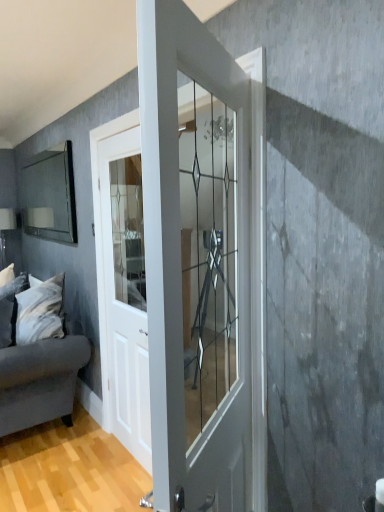
Question: Is the depth of white soft pillow at left greater than that of velvet gray couch at left?

Choices:
 (A) yes
 (B) no

Answer: (A)

Question: Does white soft pillow at left contain velvet gray couch at left?

Choices:
 (A) no
 (B) yes

Answer: (A)

Question: Considering the relative positions of white soft pillow at left and velvet gray couch at left in the image provided, is white soft pillow at left in front of velvet gray couch at left?

Choices:
 (A) yes
 (B) no

Answer: (B)

Question: Considering the relative sizes of white soft pillow at left and velvet gray couch at left in the image provided, is white soft pillow at left smaller than velvet gray couch at left?

Choices:
 (A) yes
 (B) no

Answer: (A)

Question: Could you tell me if white soft pillow at left is turned towards velvet gray couch at left?

Choices:
 (A) yes
 (B) no

Answer: (A)

Question: In the image, is white glossy door at center, which is the 2th door in front-to-back order, on the left side or the right side of white soft pillow at left?

Choices:
 (A) left
 (B) right

Answer: (B)

Question: Is point (139, 443) closer or farther from the camera than point (4, 339)?

Choices:
 (A) farther
 (B) closer

Answer: (B)

Question: Based on their sizes in the image, would you say white glossy door at center, which is the 2th door in front-to-back order, is bigger or smaller than white soft pillow at left?

Choices:
 (A) big
 (B) small

Answer: (A)

Question: Do you think white glossy door at center, which is the 2th door in front-to-back order, is within white soft pillow at left, or outside of it?

Choices:
 (A) inside
 (B) outside

Answer: (B)

Question: In terms of size, does clear glass door at center, which ranks as the 1th door in front-to-back order, appear bigger or smaller than white glossy door at center, which is the first door in back-to-front order?

Choices:
 (A) big
 (B) small

Answer: (A)

Question: In terms of height, does clear glass door at center, which appears as the second door when viewed from the back, look taller or shorter compared to white glossy door at center, the 1th door positioned from the left?

Choices:
 (A) tall
 (B) short

Answer: (B)

Question: Relative to white glossy door at center, acting as the second door starting from the right, is clear glass door at center, positioned as the first door in right-to-left order, in front or behind?

Choices:
 (A) front
 (B) behind

Answer: (A)

Question: In terms of width, does clear glass door at center, arranged as the second door when viewed from the left, look wider or thinner when compared to white glossy door at center, acting as the second door starting from the right?

Choices:
 (A) wide
 (B) thin

Answer: (A)

Question: Is matte glass mirror at left bigger or smaller than white soft pillow at left?

Choices:
 (A) big
 (B) small

Answer: (B)

Question: Relative to white soft pillow at left, is matte glass mirror at left in front or behind?

Choices:
 (A) front
 (B) behind

Answer: (B)